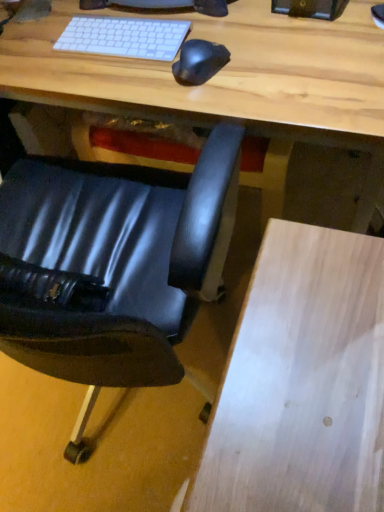
Where is `vacant area that is in front of black rubber mouse at center`? This screenshot has width=384, height=512. vacant area that is in front of black rubber mouse at center is located at coordinates (228, 111).